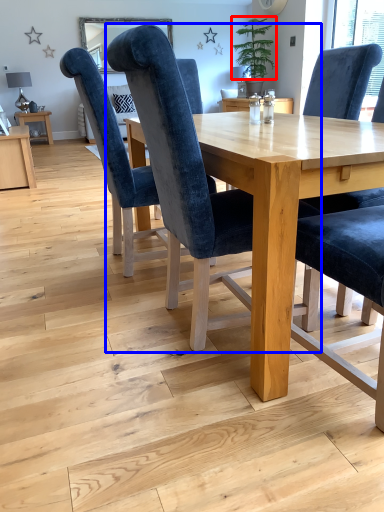
Question: Which object is closer to the camera taking this photo, plant (highlighted by a red box) or chair (highlighted by a blue box)?

Choices:
 (A) plant
 (B) chair

Answer: (B)